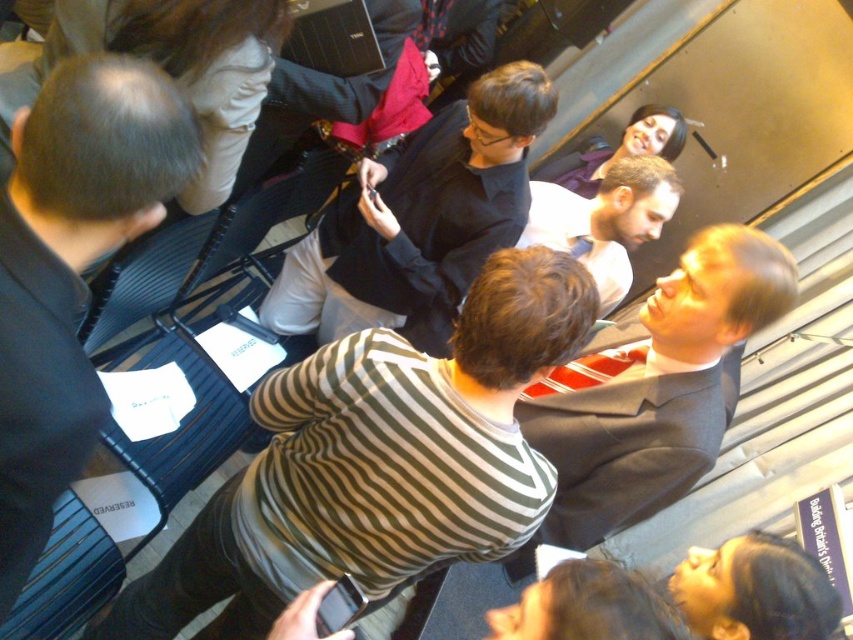
Question: In this image, where is striped cotton shirt at center located relative to black glossy shirt at center?

Choices:
 (A) above
 (B) below

Answer: (B)

Question: Is black shirt at left positioned before dark gray suit at center?

Choices:
 (A) no
 (B) yes

Answer: (B)

Question: Which point is farther to the camera?

Choices:
 (A) black glossy shirt at center
 (B) striped cotton shirt at center

Answer: (A)

Question: Among these points, which one is farthest from the camera?

Choices:
 (A) (19, 220)
 (B) (332, 209)

Answer: (B)

Question: Estimate the real-world distances between objects in this image. Which object is closer to the black glossy shirt at center?

Choices:
 (A) striped cotton shirt at center
 (B) black shirt at left
 (C) dark gray suit at center

Answer: (C)

Question: Can you confirm if black shirt at left is bigger than dark gray suit at center?

Choices:
 (A) yes
 (B) no

Answer: (B)